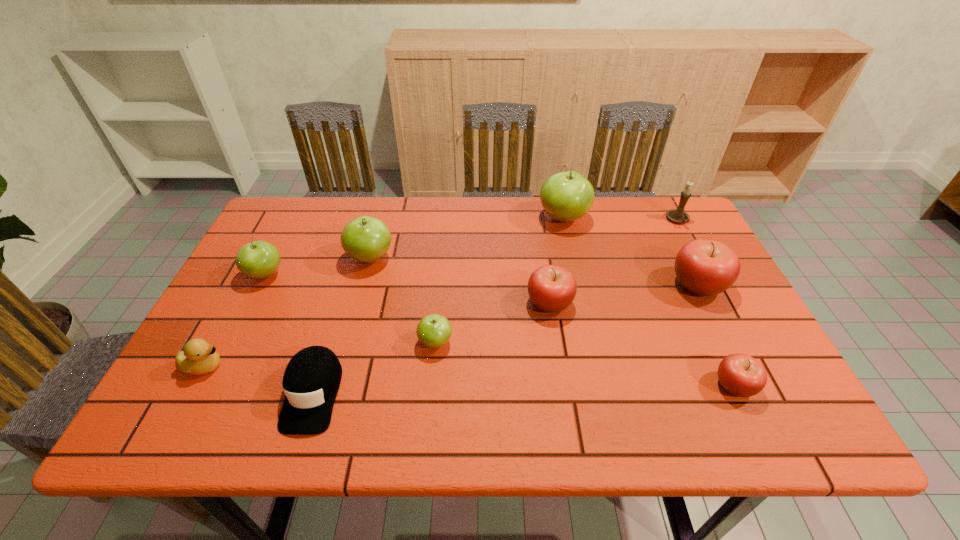
Locate an element on the screen. Image resolution: width=960 pixels, height=540 pixels. the tallest apple is located at coordinates (566, 196).

Where is `the farthest green apple`? The height and width of the screenshot is (540, 960). the farthest green apple is located at coordinates (566, 196).

What are the coordinates of `the sixth apple from right to left` in the screenshot? It's located at (366, 239).

Locate an element on the screen. the second green apple from left to right is located at coordinates (366, 239).

This screenshot has width=960, height=540. I want to click on the biggest red apple, so click(705, 267).

Identify the location of candle holder. This screenshot has height=540, width=960. (678, 215).

Image resolution: width=960 pixels, height=540 pixels. I want to click on the second smallest green apple, so click(x=259, y=259).

Where is `the leftmost apple`? This screenshot has width=960, height=540. the leftmost apple is located at coordinates (259, 259).

Identify the location of the leftmost red apple. The height and width of the screenshot is (540, 960). (551, 288).

Find the location of a particular element. The width and height of the screenshot is (960, 540). the smallest green apple is located at coordinates (434, 330).